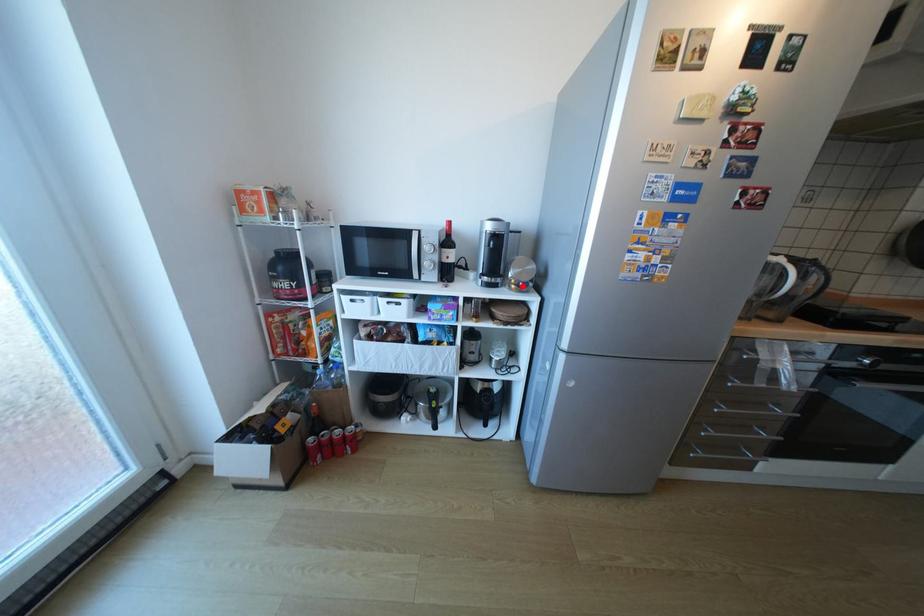
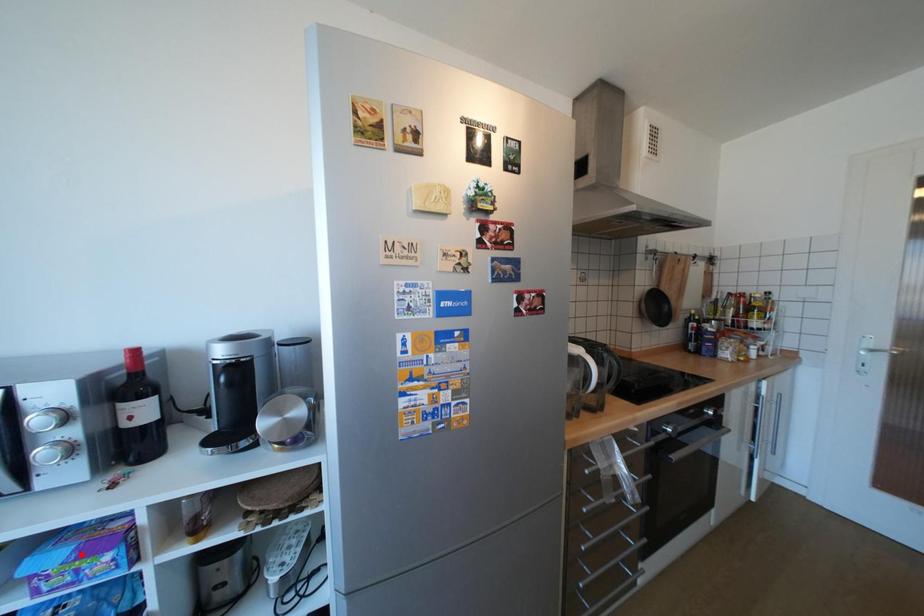
I am providing you with two images of the same scene from different viewpoints. A red point is marked on the first image and another point is marked on the second image. Does the point marked in image1 correspond to the same location as the one in image2?

No